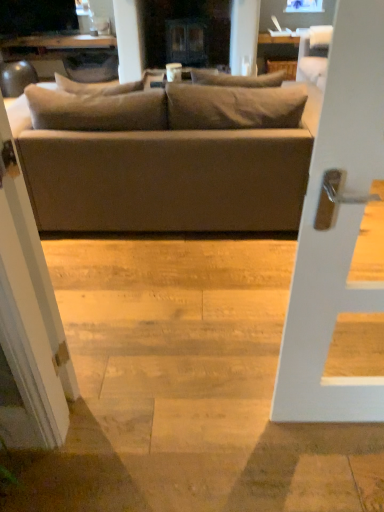
Question: Could you tell me if white glossy screen door at left is turned towards matte black tv at upper left?

Choices:
 (A) yes
 (B) no

Answer: (B)

Question: From the image's perspective, is white glossy screen door at left on matte black tv at upper left?

Choices:
 (A) yes
 (B) no

Answer: (B)

Question: Is white glossy screen door at left thinner than matte black tv at upper left?

Choices:
 (A) yes
 (B) no

Answer: (A)

Question: Does white glossy screen door at left have a greater height compared to matte black tv at upper left?

Choices:
 (A) no
 (B) yes

Answer: (B)

Question: Does white glossy screen door at left have a smaller size compared to matte black tv at upper left?

Choices:
 (A) yes
 (B) no

Answer: (A)

Question: Is white glossy screen door at left directly adjacent to matte black tv at upper left?

Choices:
 (A) no
 (B) yes

Answer: (A)

Question: Is white glossy screen door at left closer to camera compared to matte gray couch at center?

Choices:
 (A) yes
 (B) no

Answer: (A)

Question: Is white glossy screen door at left further to camera compared to matte gray couch at center?

Choices:
 (A) yes
 (B) no

Answer: (B)

Question: Could you tell me if white glossy screen door at left is facing matte gray couch at center?

Choices:
 (A) no
 (B) yes

Answer: (B)

Question: Considering the relative sizes of white glossy screen door at left and matte gray couch at center in the image provided, is white glossy screen door at left shorter than matte gray couch at center?

Choices:
 (A) yes
 (B) no

Answer: (B)

Question: Does white glossy screen door at left have a greater height compared to matte gray couch at center?

Choices:
 (A) no
 (B) yes

Answer: (B)

Question: From a real-world perspective, is white glossy screen door at left located higher than matte gray couch at center?

Choices:
 (A) yes
 (B) no

Answer: (A)

Question: Does matte gray couch at center come behind matte black tv at upper left?

Choices:
 (A) no
 (B) yes

Answer: (A)